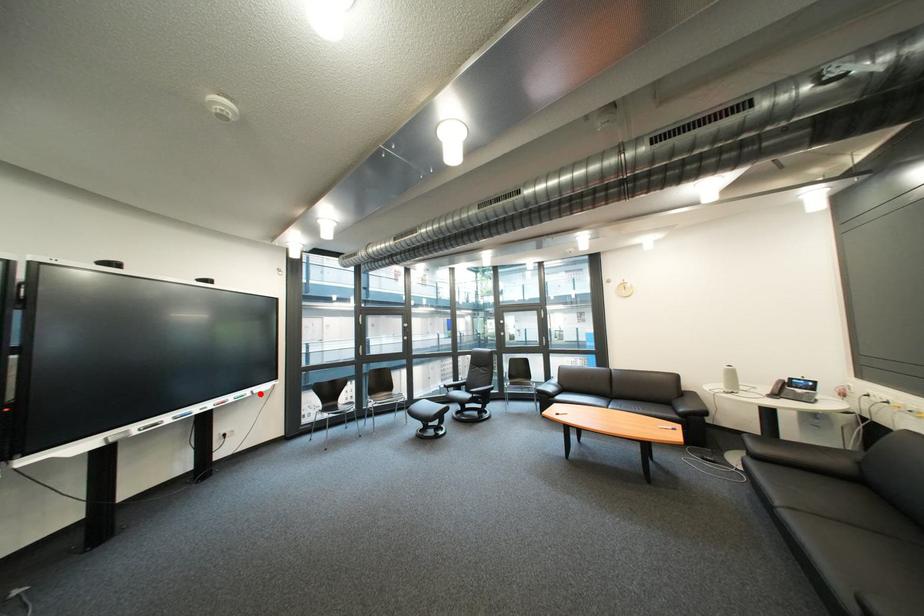
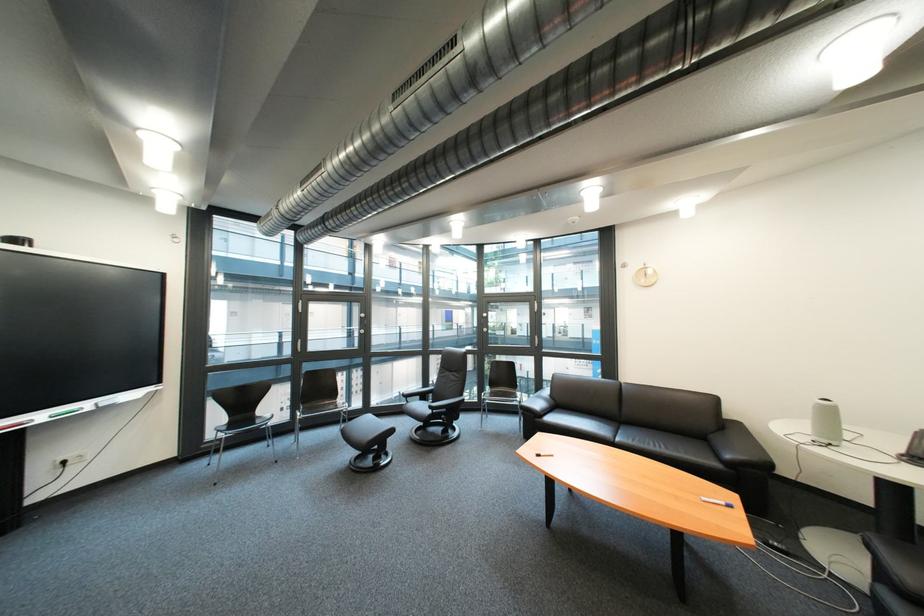
In the second image, find the point that corresponds to the highlighted location in the first image.

(101, 406)